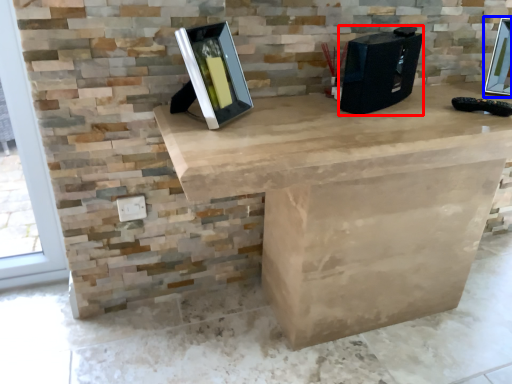
Question: Which object is further to the camera taking this photo, desktop computer (highlighted by a red box) or picture frame (highlighted by a blue box)?

Choices:
 (A) desktop computer
 (B) picture frame

Answer: (B)